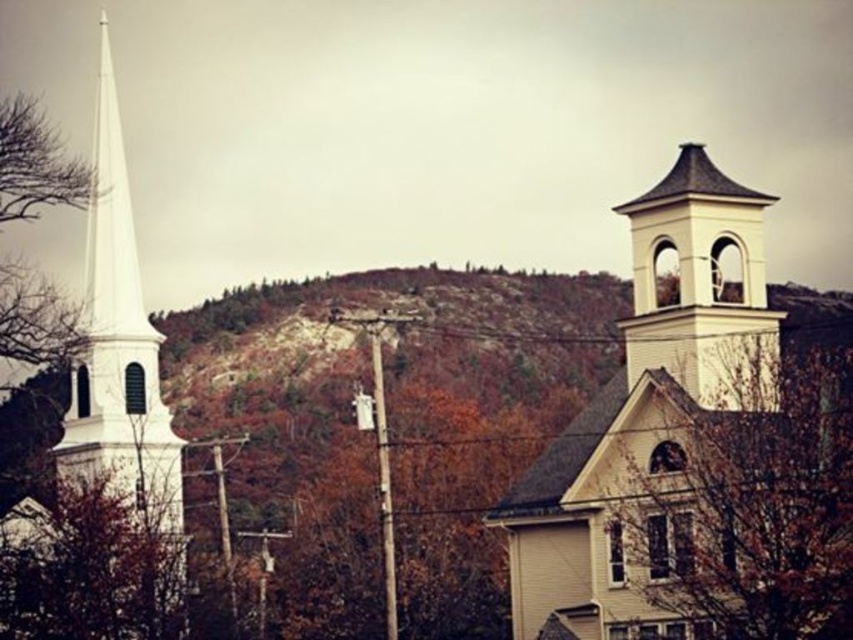
Is point (763, 346) positioned after point (142, 404)?

No, it is not.

In order to click on brown matte tree at center-right in this screenshot , I will do `click(747, 502)`.

Consider the image. How much distance is there between white matte bell tower at upper right and brown matte tree at center-right?

The distance of white matte bell tower at upper right from brown matte tree at center-right is 4.03 meters.

Between point (699, 250) and point (746, 456), which one is positioned behind?

Point (699, 250)

Between point (641, 548) and point (648, 577), which one is positioned behind?

The point (641, 548) is more distant.

This screenshot has height=640, width=853. Find the location of `white matte bell tower at upper right`. white matte bell tower at upper right is located at coordinates (645, 408).

Can you confirm if white smooth steeple at left is positioned above white painted wood bell tower at upper right?

Yes, white smooth steeple at left is above white painted wood bell tower at upper right.

Is point (107, 410) less distant than point (756, 205)?

No, (107, 410) is behind (756, 205).

Is point (96, 308) farther from viewer compared to point (717, 388)?

Yes, it is behind point (717, 388).

Locate an element on the screen. The width and height of the screenshot is (853, 640). white smooth steeple at left is located at coordinates (123, 365).